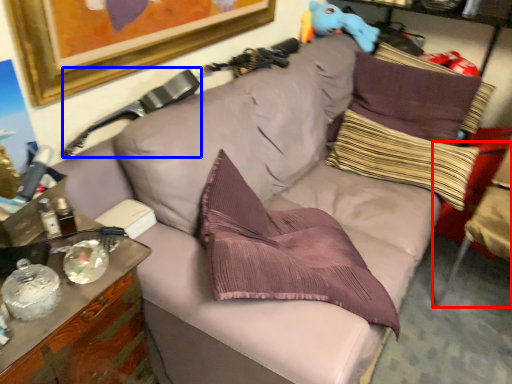
Question: Which object appears farthest to the camera in this image, swivel chair (highlighted by a red box) or swivel chair (highlighted by a blue box)?

Choices:
 (A) swivel chair
 (B) swivel chair

Answer: (A)